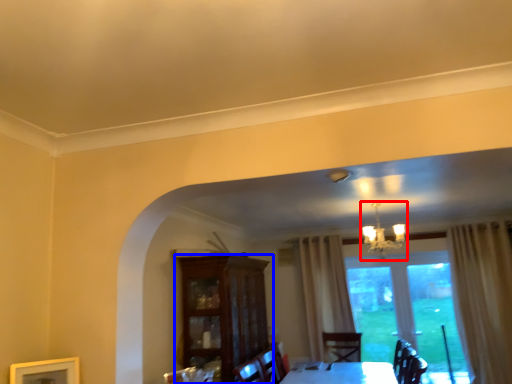
Question: Which object is closer to the camera taking this photo, light fixture (highlighted by a red box) or cabinetry (highlighted by a blue box)?

Choices:
 (A) light fixture
 (B) cabinetry

Answer: (B)